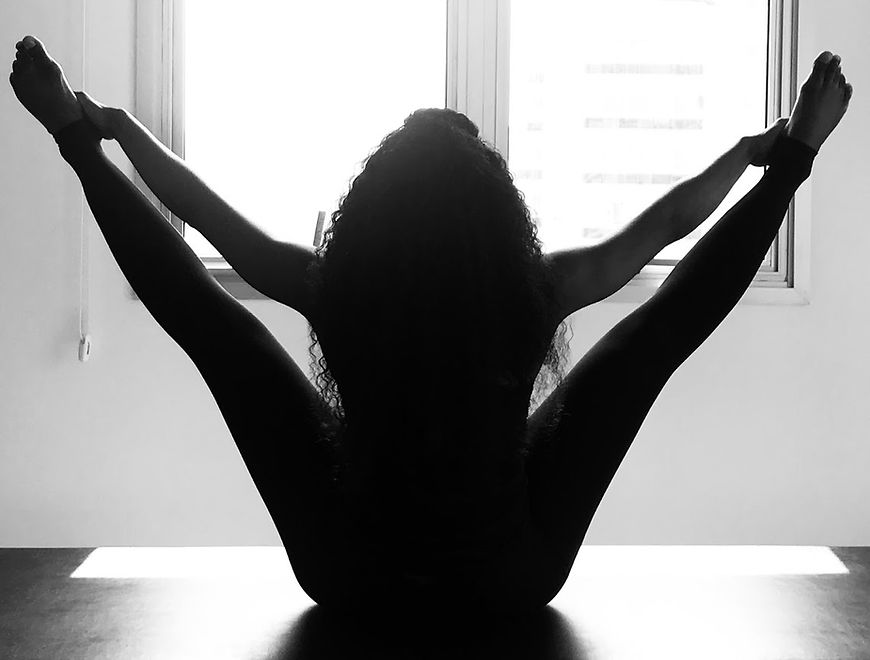
Find the location of a particular element. blind cord is located at coordinates (85, 350).